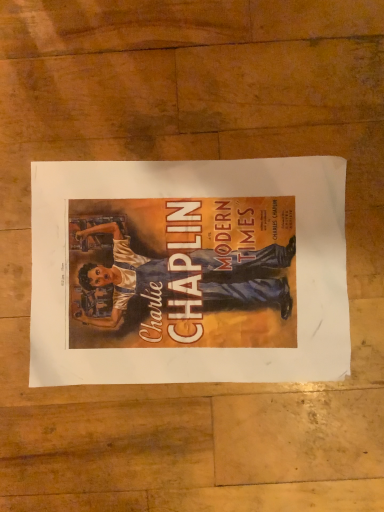
The height and width of the screenshot is (512, 384). Find the location of `free point above matte paper poster at center (from a real-world perspective)`. free point above matte paper poster at center (from a real-world perspective) is located at coordinates (194, 271).